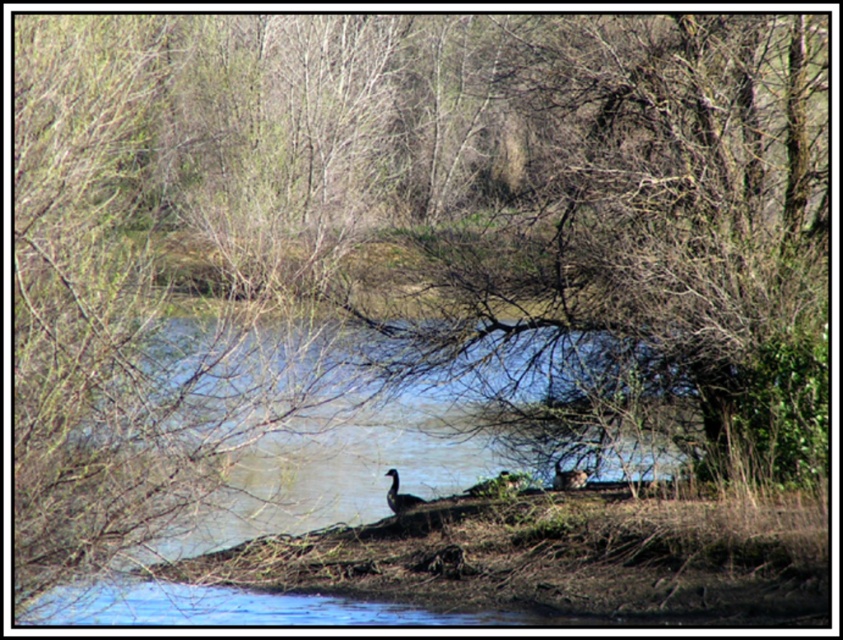
Question: Does clear blue water at center appear over dark gray duck at center?

Choices:
 (A) yes
 (B) no

Answer: (A)

Question: Is clear blue water at center smaller than brown matte duck at center?

Choices:
 (A) yes
 (B) no

Answer: (B)

Question: Which point is closer to the camera taking this photo?

Choices:
 (A) (399, 513)
 (B) (184, 534)

Answer: (B)

Question: Which object appears closest to the camera in this image?

Choices:
 (A) clear blue water at center
 (B) dark gray duck at center
 (C) brown matte duck at center

Answer: (A)

Question: Among these objects, which one is farthest from the camera?

Choices:
 (A) brown matte duck at center
 (B) dark gray duck at center

Answer: (A)

Question: Does clear blue water at center appear on the right side of brown matte duck at center?

Choices:
 (A) no
 (B) yes

Answer: (A)